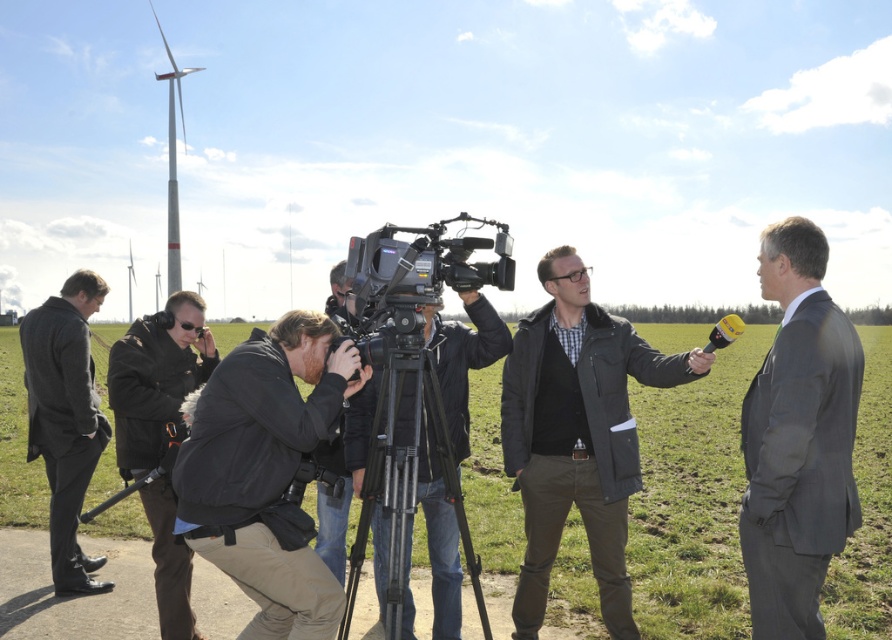
Question: Which point is closer to the camera taking this photo?

Choices:
 (A) click(93, 468)
 (B) click(333, 269)
 (C) click(434, 595)
 (D) click(178, 563)

Answer: (C)

Question: Based on their relative distances, which object is nearer to the gray wool suit at right?

Choices:
 (A) dark gray wool coat at left
 (B) matte black camera at center
 (C) silver metallic tripod at center
 (D) dark gray jacket at lower left

Answer: (C)

Question: Can you confirm if dark gray jacket at center is bigger than gray wool suit at right?

Choices:
 (A) no
 (B) yes

Answer: (B)

Question: Estimate the real-world distances between objects in this image. Which object is closer to the dark gray jacket at center?

Choices:
 (A) gray wool suit at right
 (B) dark gray wool coat at left
 (C) dark gray jacket at lower left

Answer: (A)

Question: Does dark gray jacket at center have a greater width compared to gray wool suit at right?

Choices:
 (A) yes
 (B) no

Answer: (A)

Question: Can you confirm if black matte jacket at center is positioned to the right of silver metallic tripod at center?

Choices:
 (A) no
 (B) yes

Answer: (A)